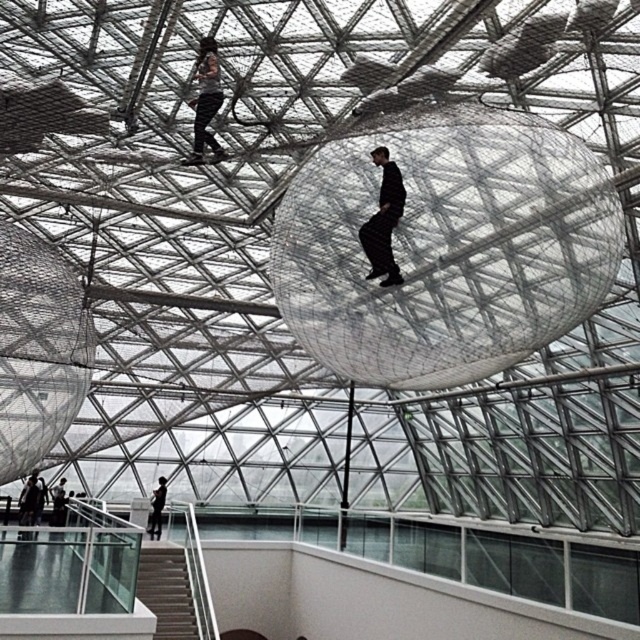
You are standing at the entrance of this modern architectural space and want to reach the area near the white glossy stair at lower left and the matte black pants at upper center. Which object will you encounter first as you move forward?

You will encounter the white glossy stair at lower left first because it is closer to you than the matte black pants at upper center, which is further away.